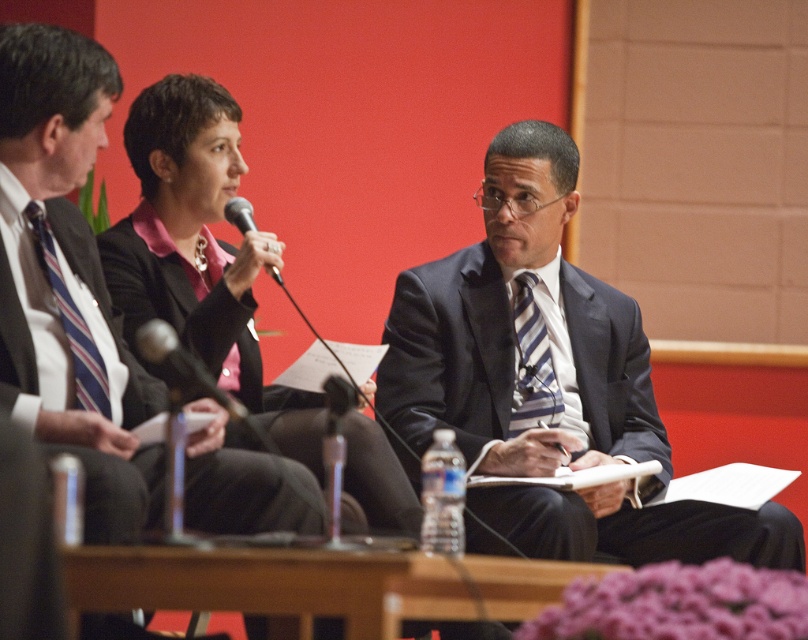
The width and height of the screenshot is (808, 640). What do you see at coordinates (66, 282) in the screenshot? I see `matte black suit at center` at bounding box center [66, 282].

Who is lower down, matte black suit at center or wooden table at center?

Positioned lower is wooden table at center.

Which is behind, point (118, 330) or point (74, 611)?

Positioned behind is point (118, 330).

This screenshot has width=808, height=640. What are the coordinates of `matte black suit at center` in the screenshot? It's located at (66, 282).

Can you confirm if striped fabric tie at left is positioned above black metallic microphone at center?

Indeed, striped fabric tie at left is positioned over black metallic microphone at center.

Consider the image. Can you confirm if striped fabric tie at left is positioned to the right of black metallic microphone at center?

No, striped fabric tie at left is not to the right of black metallic microphone at center.

Between point (53, 257) and point (167, 326), which one is positioned behind?

Point (167, 326)

Find the location of a particular element. This screenshot has height=640, width=808. striped fabric tie at left is located at coordinates (70, 321).

Does wooden table at center appear on the right side of dark blue textured suit at center?

Indeed, wooden table at center is positioned on the right side of dark blue textured suit at center.

Who is more forward, (x=335, y=580) or (x=137, y=276)?

Point (x=335, y=580) is in front.

Who is more forward, (394,588) or (393,476)?

Point (394,588) is more forward.

Identify the location of wooden table at center. The image size is (808, 640). (316, 584).